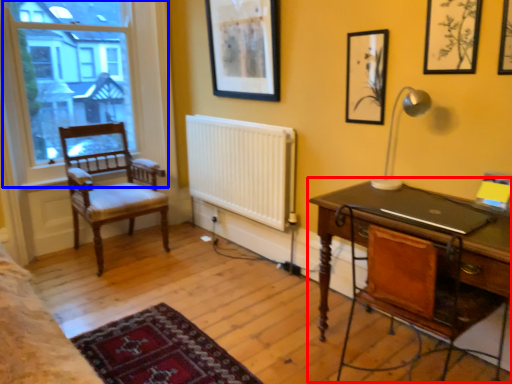
Question: Which object appears closest to the camera in this image, desk (highlighted by a red box) or window (highlighted by a blue box)?

Choices:
 (A) desk
 (B) window

Answer: (A)